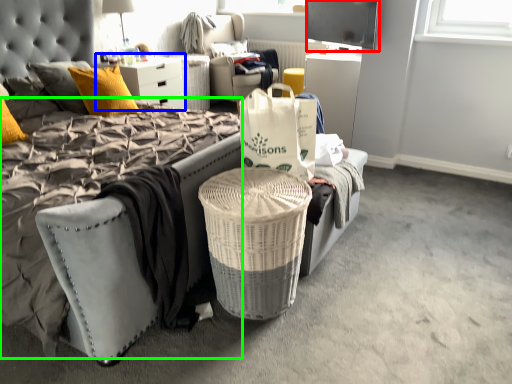
Question: Which is farther away from television (highlighted by a red box)? dresser (highlighted by a blue box) or mattress (highlighted by a green box)?

Choices:
 (A) dresser
 (B) mattress

Answer: (B)